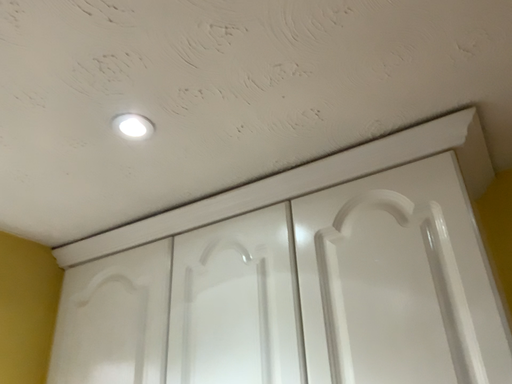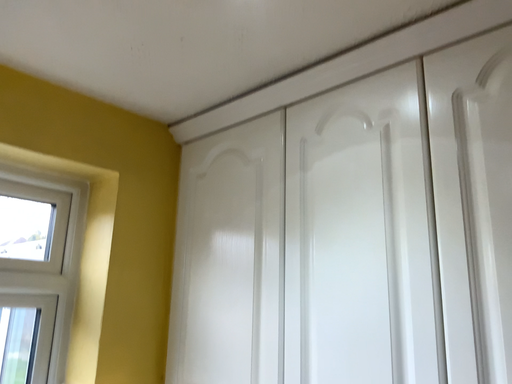
Question: Which way did the camera rotate in the video?

Choices:
 (A) rotated left
 (B) rotated right

Answer: (A)